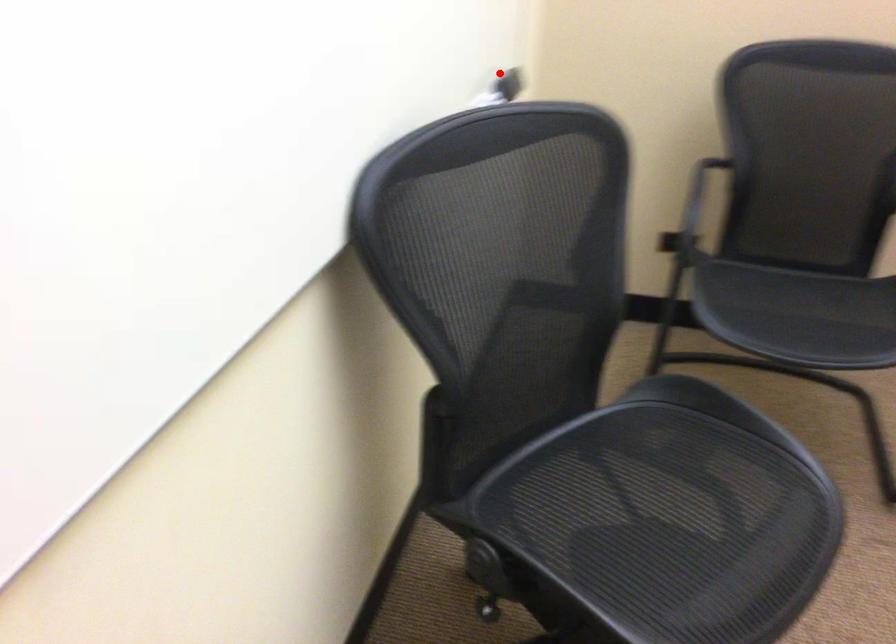
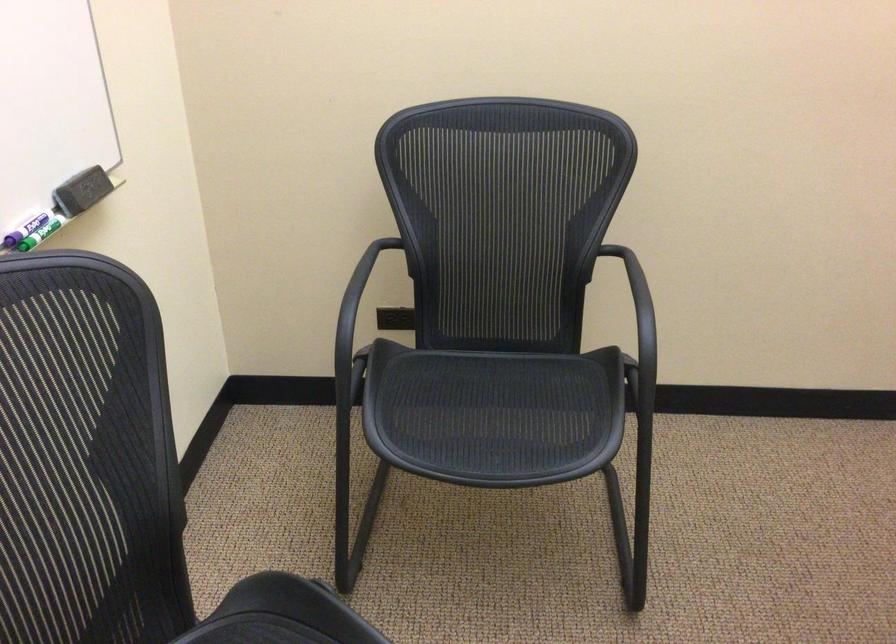
Question: I am providing you with two images of the same scene from different viewpoints. Image1 has a red point marked. In image2, the corresponding 3D location appears at what relative position? Reply with the corresponding letter.

Choices:
 (A) Closer
 (B) Farther

Answer: (A)